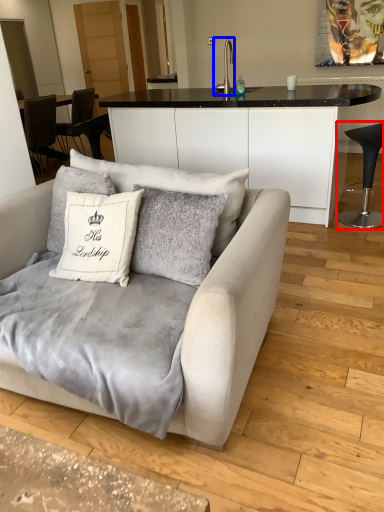
Question: Which of the following is the closest to the observer, chair (highlighted by a red box) or silver (highlighted by a blue box)?

Choices:
 (A) chair
 (B) silver

Answer: (A)